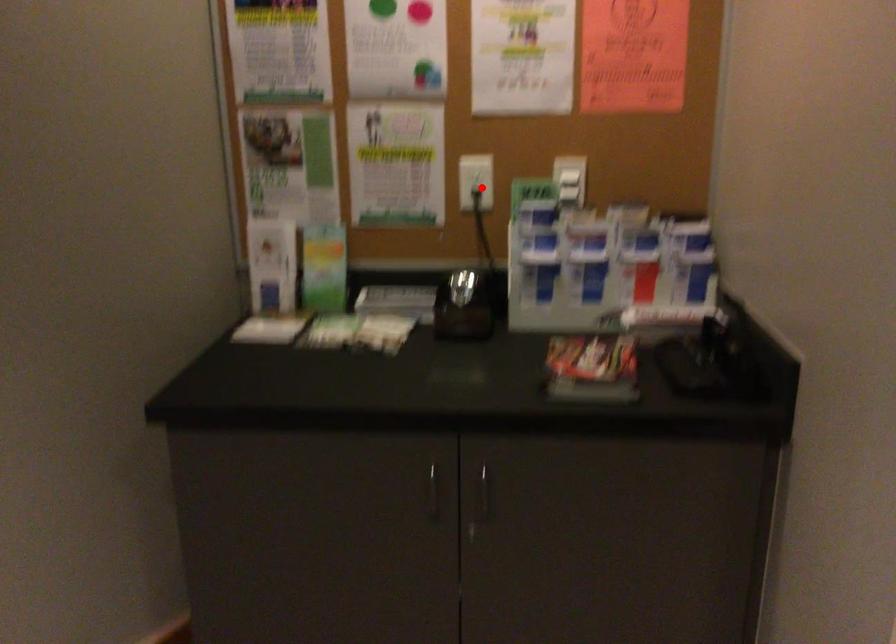
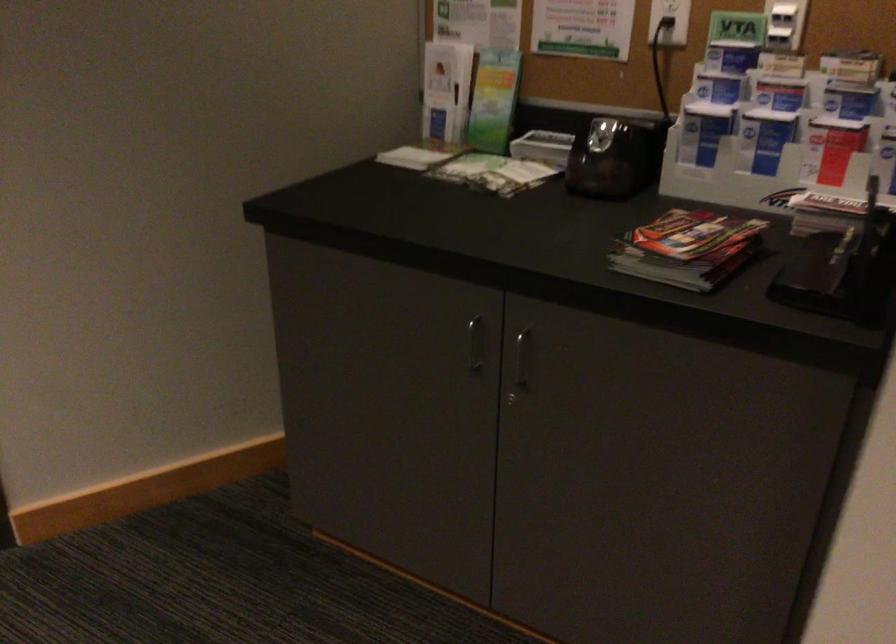
Where in the second image is the point corresponding to the highlighted location from the first image?

(669, 21)